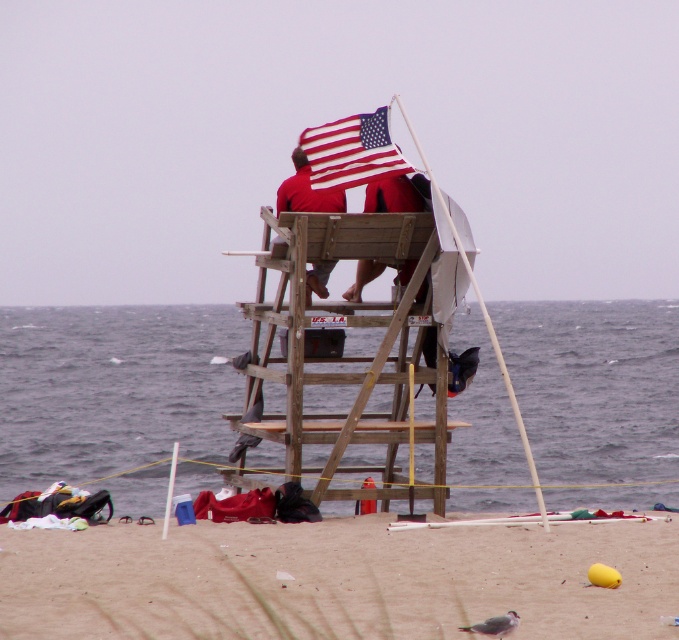
Between gray water at lower center and wooden lifeguard tower at center, which one has more height?

With more height is gray water at lower center.

Can you confirm if gray water at lower center is bigger than wooden lifeguard tower at center?

Yes.

Between point (213, 368) and point (297, 476), which one is positioned in front?

Point (297, 476) is in front.

The width and height of the screenshot is (679, 640). I want to click on gray water at lower center, so click(111, 388).

Can you confirm if smooth sand at lower center is wider than wooden lifeguard tower at center?

Yes, smooth sand at lower center is wider than wooden lifeguard tower at center.

Who is taller, smooth sand at lower center or wooden lifeguard tower at center?

With more height is wooden lifeguard tower at center.

Is point (177, 595) positioned after point (331, 456)?

No.

I want to click on smooth sand at lower center, so click(x=335, y=579).

Where is `smooth sand at lower center`? The image size is (679, 640). smooth sand at lower center is located at coordinates (335, 579).

Can you confirm if smooth sand at lower center is positioned below red matte shirt at center?

Yes, smooth sand at lower center is below red matte shirt at center.

The width and height of the screenshot is (679, 640). In order to click on smooth sand at lower center in this screenshot , I will do `click(335, 579)`.